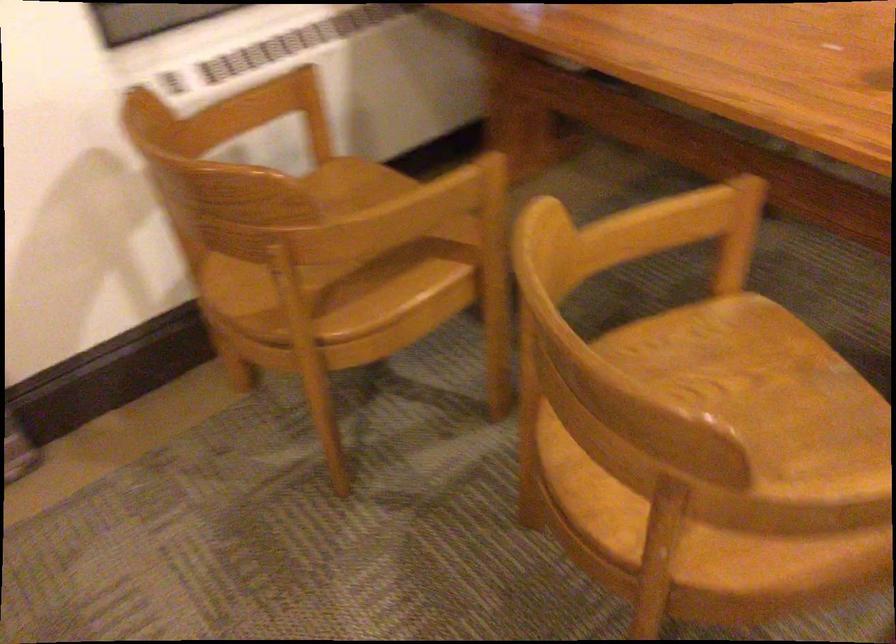
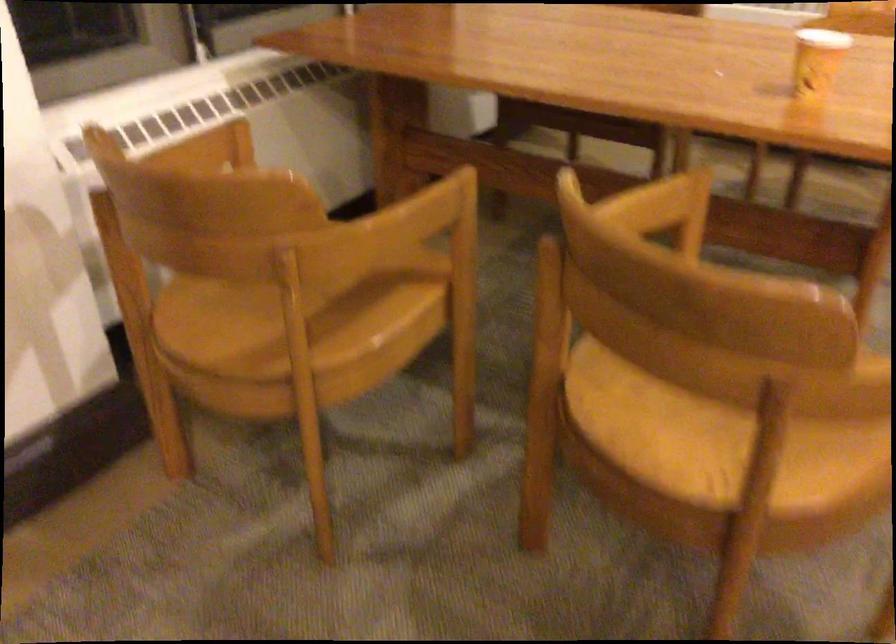
Question: Based on the continuous images, in which direction is the camera rotating? Reply with the corresponding letter.

Choices:
 (A) Left
 (B) Right
 (C) Up
 (D) Down

Answer: (B)